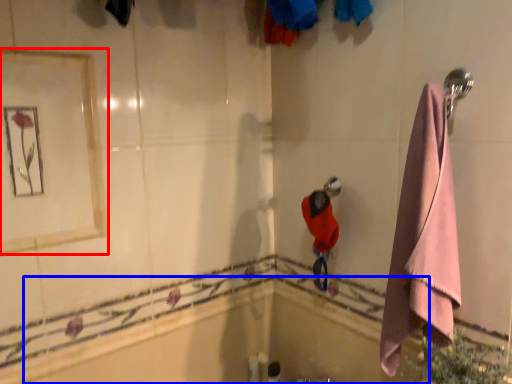
Question: Among these objects, which one is nearest to the camera, mirror (highlighted by a red box) or bath (highlighted by a blue box)?

Choices:
 (A) mirror
 (B) bath

Answer: (A)